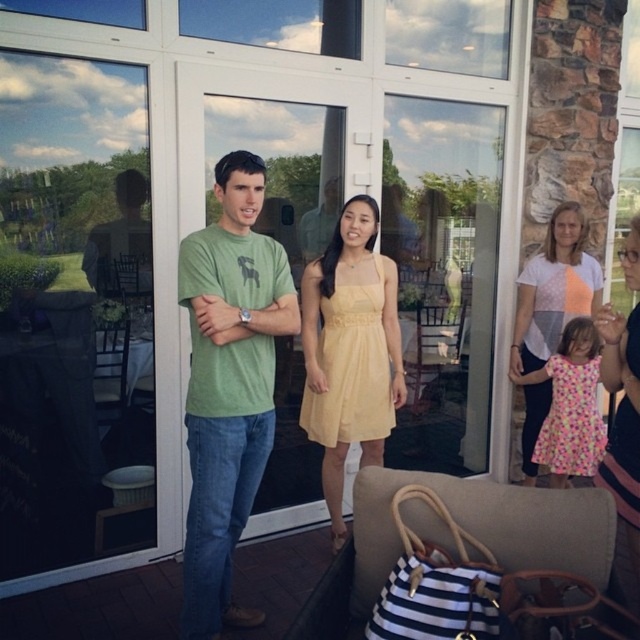
Can you confirm if yellow chiffon dress at center is taller than matte pink dress at lower right?

No.

Which is more to the left, yellow chiffon dress at center or matte pink dress at lower right?

Positioned to the left is yellow chiffon dress at center.

At what (x,y) coordinates should I click in order to perform the action: click on yellow chiffon dress at center. Please return your answer as a coordinate pair (x, y). This screenshot has width=640, height=640. Looking at the image, I should click on (352, 365).

Locate an element on the screen. The width and height of the screenshot is (640, 640). green t-shirt at center is located at coordinates (228, 385).

Is yellow satin dress at center smaller than floral cotton dress at lower right?

No.

Is yellow satin dress at center closer to camera compared to floral cotton dress at lower right?

Yes, it is.

Between point (326, 464) and point (580, 476), which one is positioned in front?

Point (326, 464) is in front.

Image resolution: width=640 pixels, height=640 pixels. I want to click on yellow satin dress at center, so click(x=349, y=349).